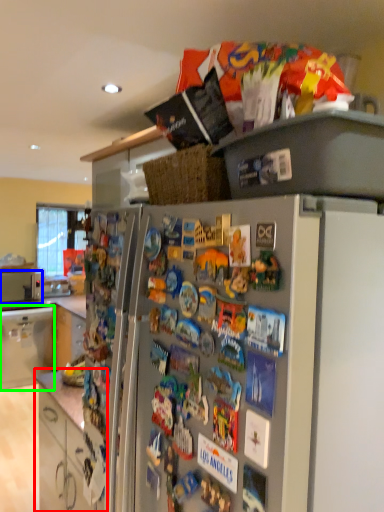
Question: Considering the real-world distances, which object is farthest from cabinetry (highlighted by a red box)? appliance (highlighted by a blue box) or cabinetry (highlighted by a green box)?

Choices:
 (A) appliance
 (B) cabinetry

Answer: (A)